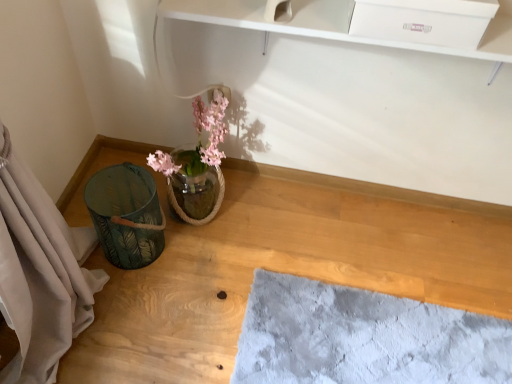
Image resolution: width=512 pixels, height=384 pixels. I want to click on green leaf-patterned basket at left, so click(126, 215).

What do you see at coordinates (197, 166) in the screenshot?
I see `translucent glass vase at center` at bounding box center [197, 166].

Find the location of `white glossy drawer at upper center`. white glossy drawer at upper center is located at coordinates (424, 21).

Is white glossy drawer at upper center in contact with green leaf-patterned basket at left?

No.

Does white glossy drawer at upper center have a lesser height compared to green leaf-patterned basket at left?

Yes, white glossy drawer at upper center is shorter than green leaf-patterned basket at left.

Does white glossy drawer at upper center turn towards green leaf-patterned basket at left?

No, white glossy drawer at upper center does not turn towards green leaf-patterned basket at left.

Can you confirm if white glossy drawer at upper center is thinner than green leaf-patterned basket at left?

Yes, white glossy drawer at upper center is thinner than green leaf-patterned basket at left.

At what (x,y) coordinates should I click in order to perform the action: click on table that appears below the white glossy drawer at upper center (from a real-world perspective). Please return your answer as a coordinate pair (x, y). Looking at the image, I should click on (285, 268).

How much distance is there between white glossy drawer at upper center and green fabric basket at lower left?

The distance of white glossy drawer at upper center from green fabric basket at lower left is 33.38 inches.

From the picture: From the image's perspective, is white glossy drawer at upper center on green fabric basket at lower left?

Correct, white glossy drawer at upper center appears higher than green fabric basket at lower left in the image.

Considering the sizes of objects white glossy drawer at upper center and green fabric basket at lower left in the image provided, who is wider, white glossy drawer at upper center or green fabric basket at lower left?

green fabric basket at lower left.

Locate an element on the screen. The image size is (512, 384). floral arrangement located below the white glossy drawer at upper center (from the image's perspective) is located at coordinates (197, 166).

Which is correct: translucent glass vase at center is inside white glossy drawer at upper center, or outside of it?

translucent glass vase at center is not enclosed by white glossy drawer at upper center.

From the image's perspective, which object appears higher, translucent glass vase at center or white glossy drawer at upper center?

white glossy drawer at upper center is shown above in the image.

From a real-world perspective, is translucent glass vase at center on white glossy drawer at upper center?

No.

Is translucent glass vase at center taller or shorter than green fabric basket at lower left?

Considering their sizes, translucent glass vase at center has more height than green fabric basket at lower left.

Which is more to the right, translucent glass vase at center or green fabric basket at lower left?

Positioned to the right is green fabric basket at lower left.

Do you think translucent glass vase at center is within green fabric basket at lower left, or outside of it?

translucent glass vase at center is not inside green fabric basket at lower left, it's outside.

Where is `table that appears below the translucent glass vase at center (from the image's perspective)`? This screenshot has width=512, height=384. table that appears below the translucent glass vase at center (from the image's perspective) is located at coordinates (285, 268).

Who is taller, green leaf-patterned basket at left or white glossy drawer at upper center?

With more height is green leaf-patterned basket at left.

In the scene shown: Is green leaf-patterned basket at left oriented towards white glossy drawer at upper center?

No, green leaf-patterned basket at left is not oriented towards white glossy drawer at upper center.

Find the location of a particular element. The width and height of the screenshot is (512, 384). drawer that appears above the green leaf-patterned basket at left (from a real-world perspective) is located at coordinates (424, 21).

Can you confirm if green leaf-patterned basket at left is bigger than white glossy drawer at upper center?

Yes.

In the scene shown: From a real-world perspective, does green leaf-patterned basket at left stand above translucent glass vase at center?

Incorrect, from a real-world perspective, green leaf-patterned basket at left is lower than translucent glass vase at center.

Does green leaf-patterned basket at left lie behind translucent glass vase at center?

Yes.

Which of these two, green leaf-patterned basket at left or translucent glass vase at center, stands taller?

With more height is translucent glass vase at center.

Considering the points (114, 207) and (201, 159), which point is behind, point (114, 207) or point (201, 159)?

The point (201, 159) is farther from the camera.

Which is correct: white glossy drawer at upper center is inside translucent glass vase at center, or outside of it?

white glossy drawer at upper center is not inside translucent glass vase at center, it's outside.

From the image's perspective, is white glossy drawer at upper center located beneath translucent glass vase at center?

Incorrect, from the image's perspective, white glossy drawer at upper center is higher than translucent glass vase at center.

Considering the relative sizes of white glossy drawer at upper center and translucent glass vase at center in the image provided, is white glossy drawer at upper center bigger than translucent glass vase at center?

Incorrect, white glossy drawer at upper center is not larger than translucent glass vase at center.

What's the angular difference between white glossy drawer at upper center and translucent glass vase at center's facing directions?

The angle between the facing direction of white glossy drawer at upper center and the facing direction of translucent glass vase at center is 1.18 degrees.

The image size is (512, 384). I want to click on drawer above the green leaf-patterned basket at left (from the image's perspective), so click(424, 21).

Image resolution: width=512 pixels, height=384 pixels. Identify the location of table below the white glossy drawer at upper center (from a real-world perspective). (285, 268).

Estimate the real-world distances between objects in this image. Which object is further from green leaf-patterned basket at left, white glossy drawer at upper center or translucent glass vase at center?

white glossy drawer at upper center is positioned further to the anchor green leaf-patterned basket at left.

From the image, which object appears to be nearer to white glossy drawer at upper center, green fabric basket at lower left or translucent glass vase at center?

translucent glass vase at center is positioned closer to the anchor white glossy drawer at upper center.

From the image, which object appears to be farther from green fabric basket at lower left, translucent glass vase at center or white glossy drawer at upper center?

white glossy drawer at upper center lies further to green fabric basket at lower left than the other object.

From the image, which object appears to be farther from white glossy drawer at upper center, green fabric basket at lower left or green leaf-patterned basket at left?

green leaf-patterned basket at left lies further to white glossy drawer at upper center than the other object.

From the image, which object appears to be farther from green fabric basket at lower left, white glossy drawer at upper center or green leaf-patterned basket at left?

Based on the image, white glossy drawer at upper center appears to be further to green fabric basket at lower left.

From the image, which object appears to be nearer to green fabric basket at lower left, green leaf-patterned basket at left or translucent glass vase at center?

green leaf-patterned basket at left.

Which object lies nearer to the anchor point translucent glass vase at center, green fabric basket at lower left or green leaf-patterned basket at left?

green leaf-patterned basket at left is closer to translucent glass vase at center.

Which object lies further to the anchor point green leaf-patterned basket at left, translucent glass vase at center or white glossy drawer at upper center?

Among the two, white glossy drawer at upper center is located further to green leaf-patterned basket at left.

Identify the location of floral arrangement between green leaf-patterned basket at left and white glossy drawer at upper center from left to right. The image size is (512, 384). (x=197, y=166).

Where is `floral arrangement that lies between white glossy drawer at upper center and green fabric basket at lower left from top to bottom`? floral arrangement that lies between white glossy drawer at upper center and green fabric basket at lower left from top to bottom is located at coordinates (197, 166).

Where is `floral arrangement between green leaf-patterned basket at left and green fabric basket at lower left`? floral arrangement between green leaf-patterned basket at left and green fabric basket at lower left is located at coordinates (197, 166).

Locate an element on the screen. Image resolution: width=512 pixels, height=384 pixels. table between green leaf-patterned basket at left and white glossy drawer at upper center is located at coordinates (285, 268).